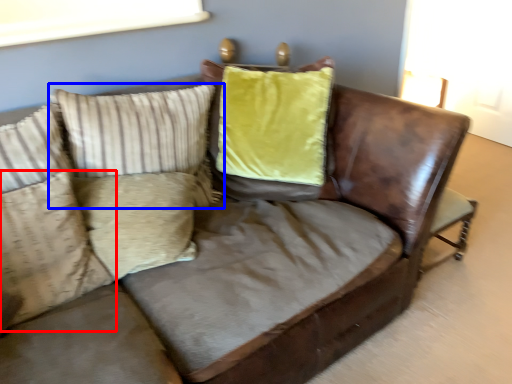
Question: Which point is further to the camera, pillow (highlighted by a red box) or pillow (highlighted by a blue box)?

Choices:
 (A) pillow
 (B) pillow

Answer: (B)